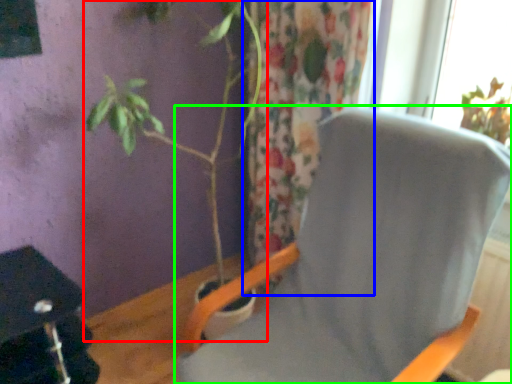
Question: Considering the real-world distances, which object is closest to houseplant (highlighted by a red box)? curtain (highlighted by a blue box) or chair (highlighted by a green box).

Choices:
 (A) curtain
 (B) chair

Answer: (A)